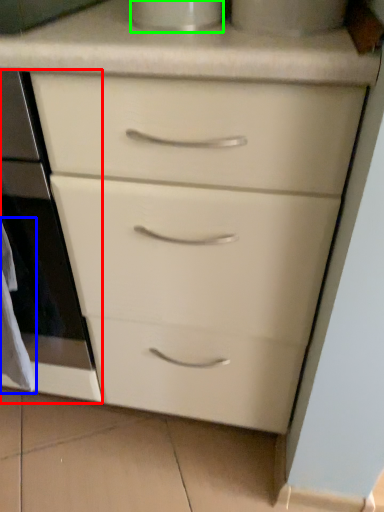
Question: Estimate the real-world distances between objects in this image. Which object is closer to oven (highlighted by a red box), material (highlighted by a blue box) or appliance (highlighted by a green box)?

Choices:
 (A) material
 (B) appliance

Answer: (A)